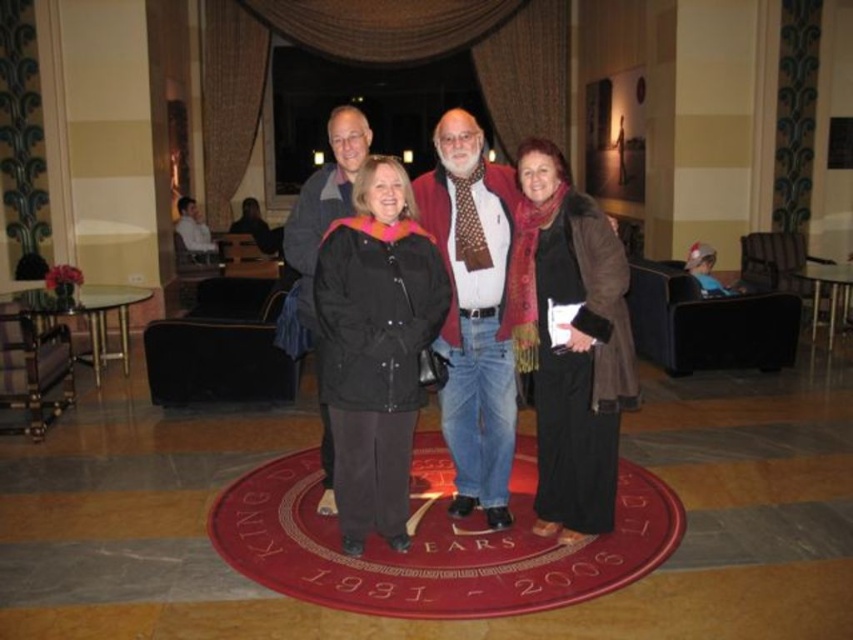
Is brown leather coat at center taller than black jacket at center?

Yes, brown leather coat at center is taller than black jacket at center.

Describe the element at coordinates (570, 342) in the screenshot. The image size is (853, 640). I see `brown leather coat at center` at that location.

The width and height of the screenshot is (853, 640). What do you see at coordinates (570, 342) in the screenshot? I see `brown leather coat at center` at bounding box center [570, 342].

At what (x,y) coordinates should I click in order to perform the action: click on brown leather coat at center. Please return your answer as a coordinate pair (x, y). Looking at the image, I should click on (570, 342).

Can you confirm if matte black jacket at center is shorter than black jacket at center?

In fact, matte black jacket at center may be taller than black jacket at center.

Is matte black jacket at center smaller than black jacket at center?

No.

Image resolution: width=853 pixels, height=640 pixels. I want to click on matte black jacket at center, so [x=474, y=308].

Does point (366, 416) come closer to viewer compared to point (579, 337)?

Yes, it is in front of point (579, 337).

Is point (427, 333) less distant than point (502, 378)?

Yes, it is in front of point (502, 378).

At what (x,y) coordinates should I click in order to perform the action: click on matte black coat at center. Please return your answer as a coordinate pair (x, y). The image size is (853, 640). Looking at the image, I should click on (375, 348).